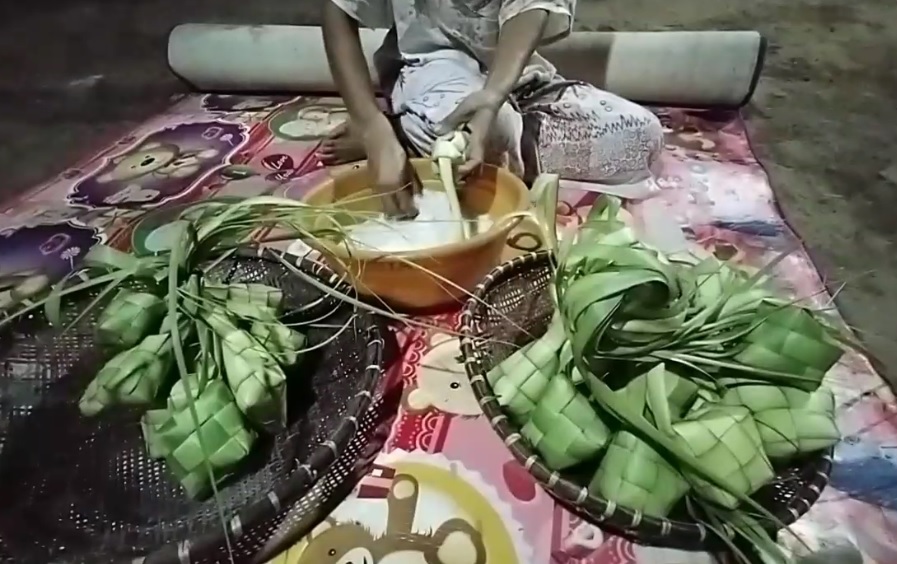
You are a GUI agent. You are given a task and a screenshot of the screen. Output one action in this format:
    pyautogui.click(x=<x>, y=<y>)
    Task: Click on the rolled out portion of rug
    The image size is (897, 564).
    Given the screenshot: What is the action you would take?
    pyautogui.click(x=169, y=149), pyautogui.click(x=434, y=422), pyautogui.click(x=707, y=176)